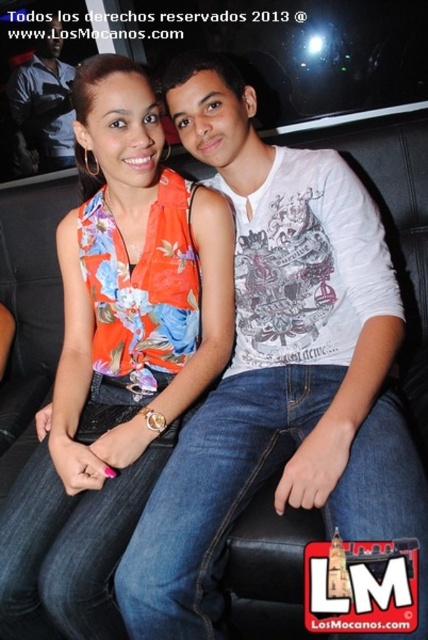
Question: Does white printed t-shirt at center come behind matte black shirt at upper left?

Choices:
 (A) yes
 (B) no

Answer: (B)

Question: Which is farther from the floral fabric top at center?

Choices:
 (A) matte black shirt at upper left
 (B) white printed t-shirt at center

Answer: (A)

Question: Which of the following is the farthest from the observer?

Choices:
 (A) (213, 540)
 (B) (181, 355)

Answer: (B)

Question: Considering the real-world distances, which object is closest to the floral fabric top at center?

Choices:
 (A) white printed t-shirt at center
 (B) matte black shirt at upper left

Answer: (A)

Question: Does white printed t-shirt at center come in front of floral fabric top at center?

Choices:
 (A) yes
 (B) no

Answer: (A)

Question: Observing the image, what is the correct spatial positioning of white printed t-shirt at center in reference to floral fabric top at center?

Choices:
 (A) above
 (B) below

Answer: (A)